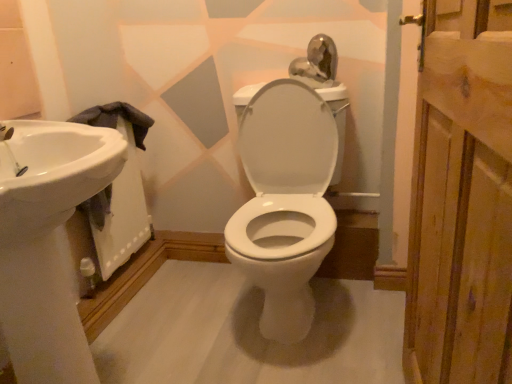
This screenshot has width=512, height=384. What are the coordinates of `white glossy sink at left` in the screenshot? It's located at (48, 243).

You are a GUI agent. You are given a task and a screenshot of the screen. Output one action in this format:
    pyautogui.click(x=<x>, y=<y>)
    Task: Click on the white glossy sink at left
    
    Given the screenshot: What is the action you would take?
    pyautogui.click(x=119, y=191)

Is white glossy sink at left next to wooden plank at right?

No, white glossy sink at left is not making contact with wooden plank at right.

Which is more to the right, white glossy sink at left or wooden plank at right?

wooden plank at right is more to the right.

From the image's perspective, is white glossy sink at left located beneath wooden plank at right?

Yes.

Is white glossy sink at left facing towards wooden plank at right?

Yes, white glossy sink at left is aimed at wooden plank at right.

The width and height of the screenshot is (512, 384). In order to click on screen door lying above the white glossy sink at left (from the image's perspective) in this screenshot , I will do `click(462, 199)`.

Is wooden plank at right shorter than white glossy sink at left?

No.

Can you confirm if wooden plank at right is thinner than white glossy sink at left?

Correct, the width of wooden plank at right is less than that of white glossy sink at left.

What's the angular difference between wooden plank at right and white glossy sink at left's facing directions?

The angular difference between wooden plank at right and white glossy sink at left is 175 degrees.

This screenshot has height=384, width=512. Find the location of `bath behind the wooden plank at right`. bath behind the wooden plank at right is located at coordinates (119, 191).

Measure the distance from white glossy sink at left to wooden plank at right.

white glossy sink at left is 3.96 feet from wooden plank at right.

Based on the photo, from the image's perspective, does white glossy sink at left appear lower than wooden plank at right?

No, from the image's perspective, white glossy sink at left is not below wooden plank at right.

Between white glossy sink at left and wooden plank at right, which one has smaller width?

With smaller width is white glossy sink at left.

How much distance is there between wooden plank at right and white glossy sink at left?

wooden plank at right and white glossy sink at left are 3.96 feet apart.

Is wooden plank at right not close to white glossy sink at left?

Yes, wooden plank at right and white glossy sink at left are located far from each other.

Between wooden plank at right and white glossy sink at left, which one is positioned behind?

Positioned behind is white glossy sink at left.

From the image's perspective, is white glossy sink at left above or below white glossy sink at left?

Based on their image positions, white glossy sink at left is located beneath white glossy sink at left.

Which object is positioned more to the right, white glossy sink at left or white glossy sink at left?

white glossy sink at left is more to the right.

Consider the image. Can you tell me how much white glossy sink at left and white glossy sink at left differ in facing direction?

white glossy sink at left and white glossy sink at left are facing 0.00642 degrees away from each other.

Does white glossy sink at left touch white glossy sink at left?

No, white glossy sink at left is not touching white glossy sink at left.

Which object is closer to the camera, white glossy sink at left or white glossy sink at left?

Positioned in front is white glossy sink at left.

Is white glossy sink at left next to white glossy sink at left and touching it?

No, white glossy sink at left is not with white glossy sink at left.

From a real-world perspective, is white glossy sink at left positioned under white glossy sink at left based on gravity?

Actually, white glossy sink at left is physically above white glossy sink at left in the real world.

This screenshot has width=512, height=384. What are the coordinates of `screen door above the white glossy sink at left (from the image's perspective)` in the screenshot? It's located at (462, 199).

Find the location of a particular element. sink located below the wooden plank at right (from the image's perspective) is located at coordinates (x=48, y=243).

From the image, which object appears to be nearer to white glossy sink at left, wooden plank at right or white glossy sink at left?

Based on the image, white glossy sink at left appears to be nearer to white glossy sink at left.

Consider the image. Estimate the real-world distances between objects in this image. Which object is further from white glossy sink at left, white glossy sink at left or wooden plank at right?

Based on the image, wooden plank at right appears to be further to white glossy sink at left.

Based on their spatial positions, is white glossy sink at left or white glossy sink at left closer to wooden plank at right?

Among the two, white glossy sink at left is located nearer to wooden plank at right.

Which object lies further to the anchor point white glossy sink at left, wooden plank at right or white glossy sink at left?

Among the two, wooden plank at right is located further to white glossy sink at left.

Considering their positions, is white glossy sink at left positioned closer to white glossy sink at left than wooden plank at right?

white glossy sink at left lies closer to white glossy sink at left than the other object.

Estimate the real-world distances between objects in this image. Which object is further from wooden plank at right, white glossy sink at left or white glossy sink at left?

white glossy sink at left is further to wooden plank at right.

I want to click on sink between wooden plank at right and white glossy sink at left along the z-axis, so click(x=48, y=243).